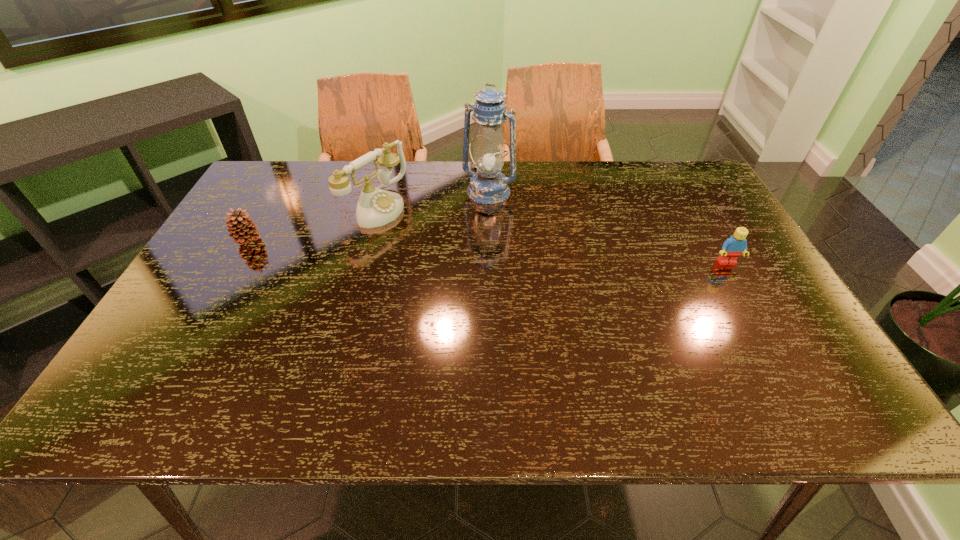
Image resolution: width=960 pixels, height=540 pixels. I want to click on free space between the third object from left to right and the Lego, so click(608, 227).

Locate an element on the screen. The image size is (960, 540). free spot between the second tallest object and the nearest object is located at coordinates (551, 234).

The height and width of the screenshot is (540, 960). In order to click on free space between the pinecone and the rightmost object in this screenshot , I will do `click(488, 251)`.

Locate an element on the screen. Image resolution: width=960 pixels, height=540 pixels. vacant point located between the rightmost object and the telephone is located at coordinates (551, 234).

At what (x,y) coordinates should I click in order to perform the action: click on blank region between the second object from left to right and the nearest object. Please return your answer as a coordinate pair (x, y). This screenshot has height=540, width=960. Looking at the image, I should click on (551, 234).

I want to click on object that is the third closest to the third object from right to left, so click(x=734, y=246).

Where is `the second closest object to the rightmost object`? The width and height of the screenshot is (960, 540). the second closest object to the rightmost object is located at coordinates (376, 207).

Find the location of a particular element. The height and width of the screenshot is (540, 960). free spot that satisfies the following two spatial constraints: 1. on the back side of the second tallest object; 2. on the right side of the tallest object is located at coordinates (380, 192).